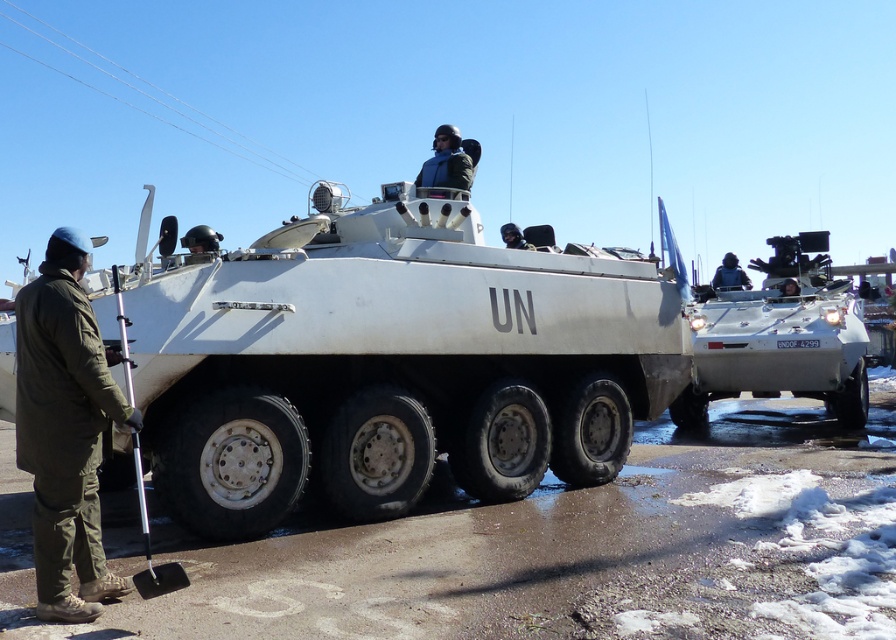
Who is positioned more to the left, dark blue uniform at center or metallic helmet at upper center?

dark blue uniform at center

Can you confirm if dark blue uniform at center is thinner than metallic helmet at upper center?

In fact, dark blue uniform at center might be wider than metallic helmet at upper center.

Which is behind, point (429, 172) or point (789, 280)?

The point (789, 280) is more distant.

Where is `dark blue uniform at center`? This screenshot has width=896, height=640. dark blue uniform at center is located at coordinates coord(446,161).

The width and height of the screenshot is (896, 640). Identify the location of silver metallic armored vehicle at center. (780, 339).

Is silver metallic armored vehicle at center thinner than blue fabric jacket at upper center?

Correct, silver metallic armored vehicle at center's width is less than blue fabric jacket at upper center's.

This screenshot has height=640, width=896. I want to click on silver metallic armored vehicle at center, so click(780, 339).

Who is lower down, green matte uniform at left or blue fabric jacket at upper center?

green matte uniform at left

Is point (65, 561) closer to camera compared to point (748, 280)?

That is True.

Locate an element on the screen. green matte uniform at left is located at coordinates (65, 428).